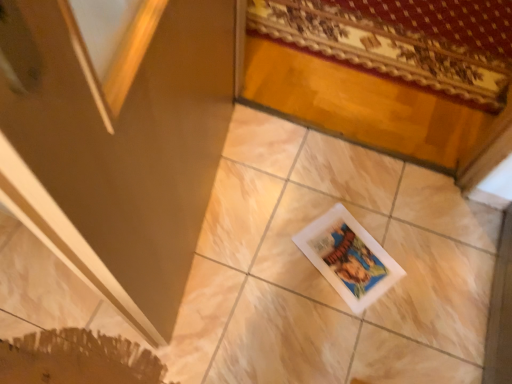
Question: From the image's perspective, is matte brown screen door at lower left positioned above or below white matte picture frame at center?

Choices:
 (A) above
 (B) below

Answer: (A)

Question: Based on their sizes in the image, would you say matte brown screen door at lower left is bigger or smaller than white matte picture frame at center?

Choices:
 (A) big
 (B) small

Answer: (A)

Question: Estimate the real-world distances between objects in this image. Which object is farther from the matte brown screen door at lower left?

Choices:
 (A) white matte picture frame at center
 (B) patterned fabric mat at upper right

Answer: (B)

Question: Estimate the real-world distances between objects in this image. Which object is closer to the white matte picture frame at center?

Choices:
 (A) matte brown screen door at lower left
 (B) patterned fabric mat at upper right

Answer: (A)